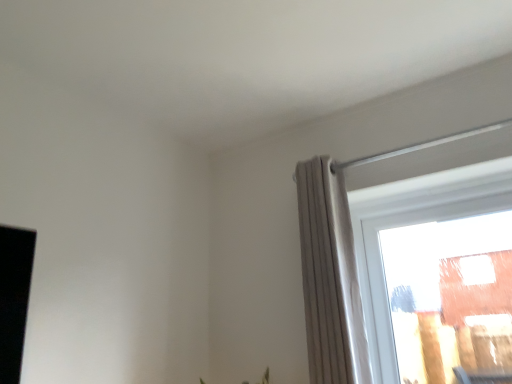
Question: Is point (333, 228) positioned closer to the camera than point (409, 258)?

Choices:
 (A) farther
 (B) closer

Answer: (B)

Question: Considering the relative positions of light gray pleated curtain at right and transparent glass window at upper right in the image provided, is light gray pleated curtain at right to the left or to the right of transparent glass window at upper right?

Choices:
 (A) right
 (B) left

Answer: (B)

Question: Is light gray pleated curtain at right situated inside transparent glass window at upper right or outside?

Choices:
 (A) outside
 (B) inside

Answer: (A)

Question: From a real-world perspective, relative to light gray pleated curtain at right, is transparent glass window at upper right vertically above or below?

Choices:
 (A) below
 (B) above

Answer: (A)

Question: Based on their sizes in the image, would you say transparent glass window at upper right is bigger or smaller than light gray pleated curtain at right?

Choices:
 (A) big
 (B) small

Answer: (B)

Question: Considering their positions, is transparent glass window at upper right located in front of or behind light gray pleated curtain at right?

Choices:
 (A) behind
 (B) front

Answer: (A)

Question: Would you say transparent glass window at upper right is to the left or to the right of light gray pleated curtain at right in the picture?

Choices:
 (A) right
 (B) left

Answer: (A)